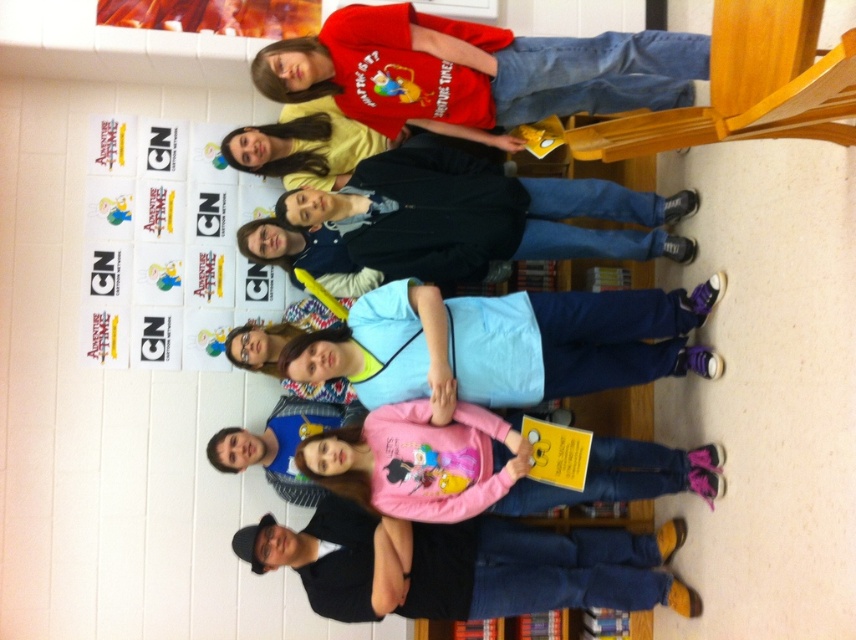
You are standing in the library and see the group of nine people arranged in a line facing the camera. There is a point at coordinate (465, 564). What object is located at that point?

The point at coordinate (465, 564) corresponds to the black matte shirt at lower center.